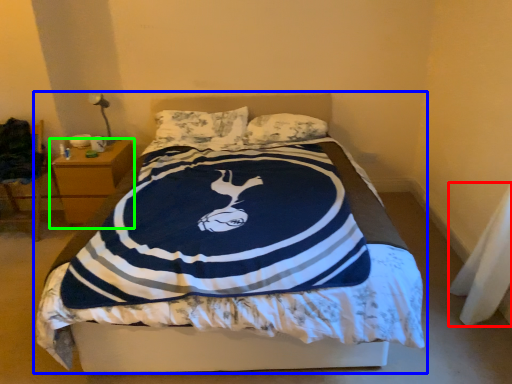
Question: Based on their relative distances, which object is farther from material (highlighted by a red box)? Choose from bed (highlighted by a blue box) and nightstand (highlighted by a green box).

Choices:
 (A) bed
 (B) nightstand

Answer: (B)